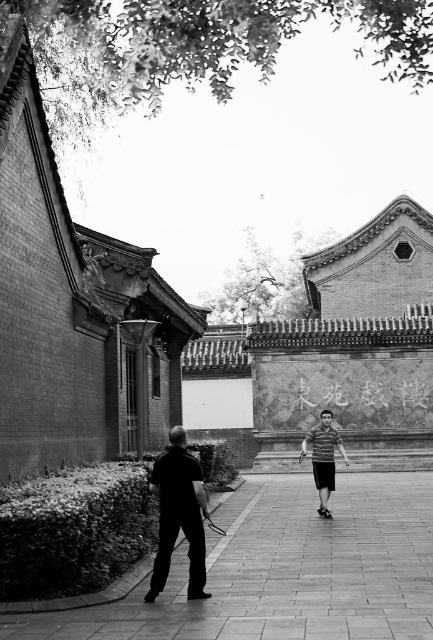
Question: Considering the real-world distances, which object is closest to the dark gray fabric shirt at center?

Choices:
 (A) smooth concrete pavement at lower left
 (B) striped fabric shirt at center

Answer: (A)

Question: Does smooth concrete pavement at lower left come behind striped fabric shirt at center?

Choices:
 (A) yes
 (B) no

Answer: (B)

Question: Estimate the real-world distances between objects in this image. Which object is farther from the striped fabric shirt at center?

Choices:
 (A) dark gray fabric shirt at center
 (B) smooth concrete pavement at lower left

Answer: (A)

Question: Which point appears farthest from the camera in this image?

Choices:
 (A) (328, 435)
 (B) (296, 593)
 (C) (197, 524)

Answer: (A)

Question: Does smooth concrete pavement at lower left appear under striped fabric shirt at center?

Choices:
 (A) yes
 (B) no

Answer: (A)

Question: Is smooth concrete pavement at lower left smaller than striped fabric shirt at center?

Choices:
 (A) yes
 (B) no

Answer: (A)